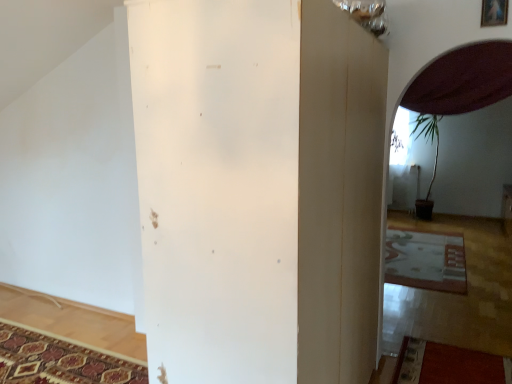
In the scene shown: In order to face wooden picture frame at upper right, should I rotate leftwards or rightwards?

You should look right and rotate roughly 29.523 degrees.

This screenshot has height=384, width=512. Describe the element at coordinates (61, 360) in the screenshot. I see `patterned carpet at lower left, which ranks as the 1th mat in front-to-back order` at that location.

This screenshot has height=384, width=512. In order to click on wooden picture frame at upper right in this screenshot , I will do `click(494, 13)`.

Is patterned carpet at lower left, placed as the 2th mat when sorted from back to front, touching wooden picture frame at upper right?

No, patterned carpet at lower left, placed as the 2th mat when sorted from back to front, is not making contact with wooden picture frame at upper right.

Is patterned carpet at lower left, which is the 1th mat in left-to-right order, to the left or to the right of wooden picture frame at upper right in the image?

Clearly, patterned carpet at lower left, which is the 1th mat in left-to-right order, is on the left of wooden picture frame at upper right in the image.

Which is less distant, (x=79, y=373) or (x=482, y=5)?

The point (x=482, y=5) is closer.

Considering the relative sizes of patterned carpet at lower left, marked as the first mat in a bottom-to-top arrangement, and wooden picture frame at upper right in the image provided, is patterned carpet at lower left, marked as the first mat in a bottom-to-top arrangement, shorter than wooden picture frame at upper right?

Yes.

Considering the sizes of objects patterned carpet at lower left, acting as the second mat starting from the right, and white matte pillar at center in the image provided, who is thinner, patterned carpet at lower left, acting as the second mat starting from the right, or white matte pillar at center?

Thinner between the two is white matte pillar at center.

What's the angular difference between patterned carpet at lower left, acting as the second mat starting from the right, and white matte pillar at center's facing directions?

179 degrees separate the facing orientations of patterned carpet at lower left, acting as the second mat starting from the right, and white matte pillar at center.

Consider the image. Does patterned carpet at lower left, which is counted as the 2th mat, starting from the top, appear on the right side of white matte pillar at center?

No.

From the image's perspective, is patterned carpet at lower left, which is counted as the 2th mat, starting from the top, below white matte pillar at center?

Yes.

Is white matte pillar at center oriented away from patterned carpet at lower right, positioned as the second mat in left-to-right order?

No, white matte pillar at center is not facing away from patterned carpet at lower right, positioned as the second mat in left-to-right order.

Does point (214, 160) appear closer or farther from the camera than point (385, 280)?

Point (214, 160) is closer to the camera than point (385, 280).

Based on their sizes in the image, would you say white matte pillar at center is bigger or smaller than patterned carpet at lower right, the second mat when ordered from bottom to top?

In the image, white matte pillar at center appears to be larger than patterned carpet at lower right, the second mat when ordered from bottom to top.

Is white matte pillar at center to the right of patterned carpet at lower right, the second mat when ordered from bottom to top, from the viewer's perspective?

In fact, white matte pillar at center is to the left of patterned carpet at lower right, the second mat when ordered from bottom to top.

Considering the relative sizes of white matte pillar at center and patterned carpet at lower left, which is the 1th mat in left-to-right order, in the image provided, is white matte pillar at center thinner than patterned carpet at lower left, which is the 1th mat in left-to-right order,?

Yes.

Which object is further away from the camera taking this photo, white matte pillar at center or patterned carpet at lower left, acting as the second mat starting from the right?

Positioned behind is patterned carpet at lower left, acting as the second mat starting from the right.

From a real-world perspective, is white matte pillar at center positioned over patterned carpet at lower left, which ranks as the 1th mat in front-to-back order, based on gravity?

Yes, from a real-world perspective, white matte pillar at center is over patterned carpet at lower left, which ranks as the 1th mat in front-to-back order

Is white matte pillar at center to the right of patterned carpet at lower left, marked as the first mat in a bottom-to-top arrangement, from the viewer's perspective?

Yes.

In terms of width, does patterned carpet at lower right, the second mat when ordered from bottom to top, look wider or thinner when compared to wooden picture frame at upper right?

In the image, patterned carpet at lower right, the second mat when ordered from bottom to top, appears to be wider than wooden picture frame at upper right.

Would you say patterned carpet at lower right, acting as the 1th mat starting from the back, is to the left or to the right of wooden picture frame at upper right in the picture?

In the image, patterned carpet at lower right, acting as the 1th mat starting from the back, appears on the right side of wooden picture frame at upper right.

Find the location of a particular element. picture frame in front of the patterned carpet at lower right, acting as the 1th mat starting from the back is located at coordinates (494, 13).

From the picture: From a real-world perspective, is patterned carpet at lower right, the 1th mat when ordered from top to bottom, beneath wooden picture frame at upper right?

Yes, from a real-world perspective, patterned carpet at lower right, the 1th mat when ordered from top to bottom, is below wooden picture frame at upper right.

Where is `pillar below the wooden picture frame at upper right (from a real-world perspective)`? This screenshot has width=512, height=384. pillar below the wooden picture frame at upper right (from a real-world perspective) is located at coordinates (218, 186).

Is point (503, 10) positioned behind point (147, 105)?

Yes, point (503, 10) is behind point (147, 105).

Is wooden picture frame at upper right not close to white matte pillar at center?

wooden picture frame at upper right is positioned a significant distance from white matte pillar at center.

Considering the relative sizes of wooden picture frame at upper right and white matte pillar at center in the image provided, is wooden picture frame at upper right thinner than white matte pillar at center?

Correct, the width of wooden picture frame at upper right is less than that of white matte pillar at center.

Is patterned carpet at lower right, which ranks as the 1th mat in right-to-left order, far from white matte pillar at center?

Absolutely, patterned carpet at lower right, which ranks as the 1th mat in right-to-left order, is distant from white matte pillar at center.

Consider the image. Which of these two, patterned carpet at lower right, the second mat when ordered from bottom to top, or white matte pillar at center, is bigger?

With larger size is white matte pillar at center.

Is patterned carpet at lower right, which is the 2th mat in front-to-back order, oriented towards white matte pillar at center?

No, patterned carpet at lower right, which is the 2th mat in front-to-back order, is not facing towards white matte pillar at center.

Can you tell me how much patterned carpet at lower right, acting as the 1th mat starting from the back, and white matte pillar at center differ in facing direction?

patterned carpet at lower right, acting as the 1th mat starting from the back, and white matte pillar at center are facing 90.2 degrees away from each other.

Where is `picture frame above the patterned carpet at lower left, which is the 1th mat in left-to-right order (from a real-world perspective)`? The width and height of the screenshot is (512, 384). picture frame above the patterned carpet at lower left, which is the 1th mat in left-to-right order (from a real-world perspective) is located at coordinates (494, 13).

Where is `mat that is the 2nd one below the white matte pillar at center (from a real-world perspective)`? The width and height of the screenshot is (512, 384). mat that is the 2nd one below the white matte pillar at center (from a real-world perspective) is located at coordinates (61, 360).

Looking at the image, which one is located closer to patterned carpet at lower right, which is the 2th mat in front-to-back order, patterned carpet at lower left, which is the 1th mat in left-to-right order, or wooden picture frame at upper right?

wooden picture frame at upper right is closer to patterned carpet at lower right, which is the 2th mat in front-to-back order.

Based on their spatial positions, is wooden picture frame at upper right or patterned carpet at lower left, marked as the first mat in a bottom-to-top arrangement, further from white matte pillar at center?

The object further to white matte pillar at center is patterned carpet at lower left, marked as the first mat in a bottom-to-top arrangement.

Estimate the real-world distances between objects in this image. Which object is closer to wooden picture frame at upper right, patterned carpet at lower right, the 1th mat when ordered from top to bottom, or patterned carpet at lower left, which is counted as the 2th mat, starting from the top?

patterned carpet at lower right, the 1th mat when ordered from top to bottom.

Looking at the image, which one is located closer to wooden picture frame at upper right, patterned carpet at lower left, which ranks as the 1th mat in front-to-back order, or white matte pillar at center?

white matte pillar at center is positioned closer to the anchor wooden picture frame at upper right.

Based on the photo, looking at the image, which one is located closer to white matte pillar at center, patterned carpet at lower left, placed as the 2th mat when sorted from back to front, or wooden picture frame at upper right?

Among the two, wooden picture frame at upper right is located nearer to white matte pillar at center.

Considering their positions, is wooden picture frame at upper right positioned further to patterned carpet at lower left, marked as the first mat in a bottom-to-top arrangement, than white matte pillar at center?

The object further to patterned carpet at lower left, marked as the first mat in a bottom-to-top arrangement, is wooden picture frame at upper right.

Based on the photo, estimate the real-world distances between objects in this image. Which object is further from white matte pillar at center, patterned carpet at lower right, which ranks as the 1th mat in right-to-left order, or patterned carpet at lower left, marked as the first mat in a bottom-to-top arrangement?

Among the two, patterned carpet at lower right, which ranks as the 1th mat in right-to-left order, is located further to white matte pillar at center.

Considering their positions, is white matte pillar at center positioned further to patterned carpet at lower right, which is the 2th mat in front-to-back order, than patterned carpet at lower left, placed as the 2th mat when sorted from back to front?

white matte pillar at center lies further to patterned carpet at lower right, which is the 2th mat in front-to-back order, than the other object.

What are the coordinates of `pillar between patterned carpet at lower left, acting as the second mat starting from the right, and patterned carpet at lower right, positioned as the second mat in left-to-right order, from left to right` in the screenshot? It's located at (218, 186).

At what (x,y) coordinates should I click in order to perform the action: click on pillar located between patterned carpet at lower left, which is counted as the 2th mat, starting from the top, and wooden picture frame at upper right in the left-right direction. Please return your answer as a coordinate pair (x, y). The image size is (512, 384). Looking at the image, I should click on (218, 186).

The image size is (512, 384). Find the location of `picture frame between white matte pillar at center and patterned carpet at lower right, which is the 2th mat in front-to-back order, in the front-back direction`. picture frame between white matte pillar at center and patterned carpet at lower right, which is the 2th mat in front-to-back order, in the front-back direction is located at coordinates (494, 13).

The width and height of the screenshot is (512, 384). I want to click on picture frame between patterned carpet at lower left, acting as the second mat starting from the right, and patterned carpet at lower right, the 1th mat when ordered from top to bottom, from left to right, so click(494, 13).